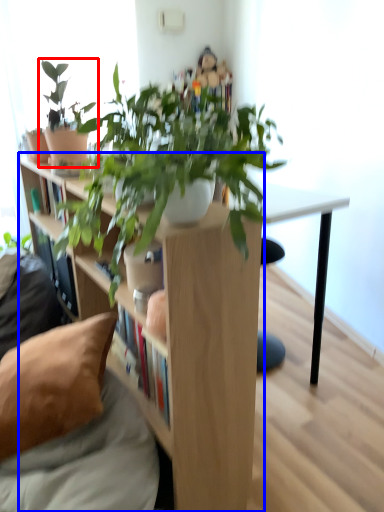
Question: Which of the following is the farthest to the observer, houseplant (highlighted by a red box) or shelf (highlighted by a blue box)?

Choices:
 (A) houseplant
 (B) shelf

Answer: (A)